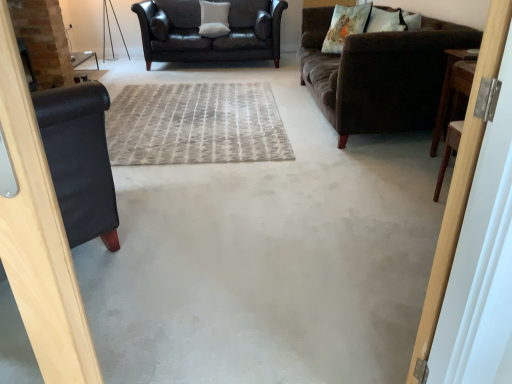
Question: Would you say gray textured rug at center is to the left or to the right of floral fabric pillow at upper right, which appears as the second pillow when viewed from the top, in the picture?

Choices:
 (A) left
 (B) right

Answer: (A)

Question: Do you think gray textured rug at center is within floral fabric pillow at upper right, which appears as the second pillow when viewed from the top, or outside of it?

Choices:
 (A) inside
 (B) outside

Answer: (B)

Question: Which of these objects is positioned farthest from the floral fabric pillow at upper right, the 2th pillow in the left-to-right sequence?

Choices:
 (A) gray textured rug at center
 (B) leather couch at upper center, which ranks as the first studio couch in back-to-front order
 (C) white soft cushion at upper center, which ranks as the third pillow in right-to-left order
 (D) wooden door at right
 (E) brown wooden table at right

Answer: (D)

Question: Which is farther from the wooden door at right?

Choices:
 (A) fluffy white pillow at upper right, the 3th pillow from the back
 (B) brown wooden table at right
 (C) gray textured rug at center
 (D) leather couch at upper center, which ranks as the first studio couch in back-to-front order
 (E) brown velvety couch at upper right, placed as the first studio couch when sorted from front to back

Answer: (D)